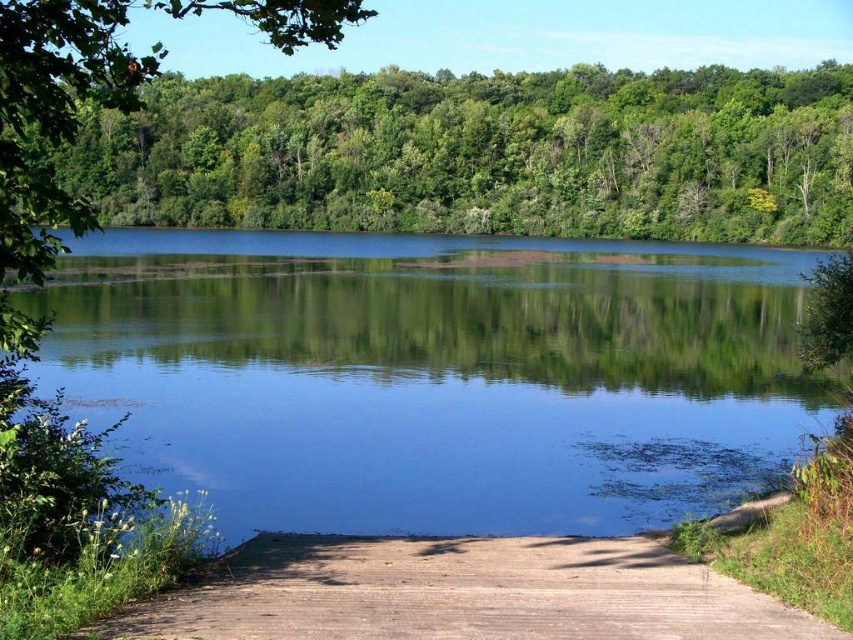
Question: Which object appears farthest from the camera in this image?

Choices:
 (A) clear water at center
 (B) brown wooden path at lower center
 (C) green leafy trees at upper center
 (D) green leafy tree at upper center

Answer: (A)

Question: Does green leafy trees at upper center come in front of green leafy tree at upper center?

Choices:
 (A) no
 (B) yes

Answer: (A)

Question: Which of the following is the farthest from the observer?

Choices:
 (A) clear water at center
 (B) green leafy trees at upper center
 (C) green leafy tree at upper center

Answer: (A)

Question: Can you confirm if green leafy trees at upper center is positioned to the right of green leafy tree at upper center?

Choices:
 (A) no
 (B) yes

Answer: (B)

Question: Can you confirm if green leafy trees at upper center is positioned below green leafy tree at upper center?

Choices:
 (A) no
 (B) yes

Answer: (B)

Question: Which of these objects is positioned closest to the brown wooden path at lower center?

Choices:
 (A) clear water at center
 (B) green leafy trees at upper center
 (C) green leafy tree at upper center

Answer: (A)